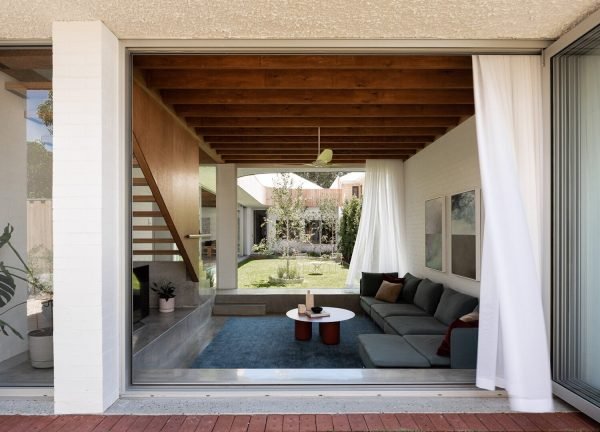
I want to click on back sofa cushion, so click(x=372, y=279), click(x=407, y=282), click(x=425, y=295), click(x=450, y=303).